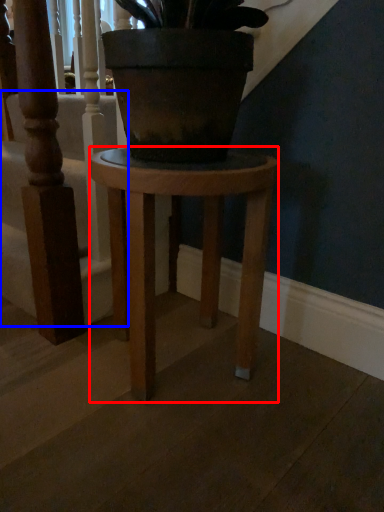
Question: Which object is further to the camera taking this photo, stool (highlighted by a red box) or stairwell (highlighted by a blue box)?

Choices:
 (A) stool
 (B) stairwell

Answer: (B)